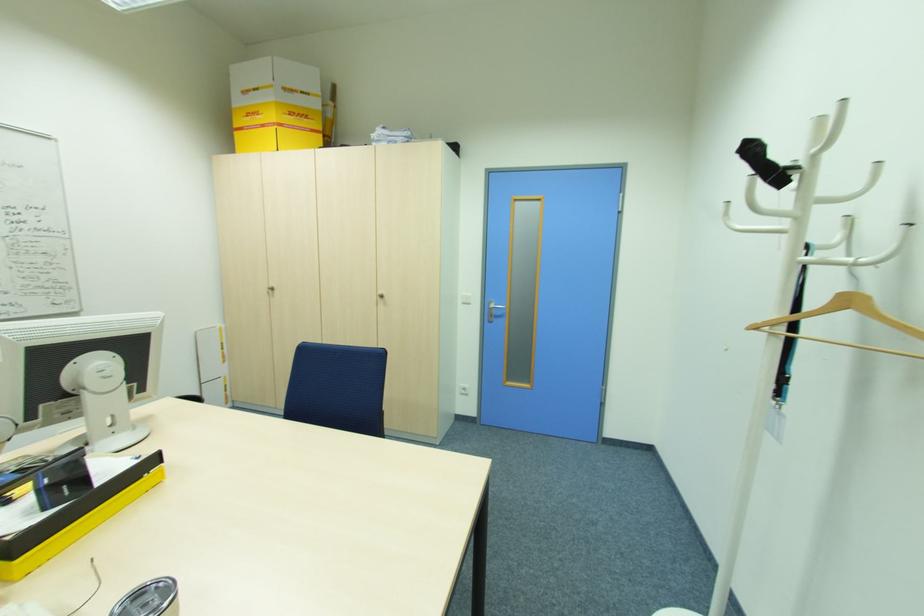
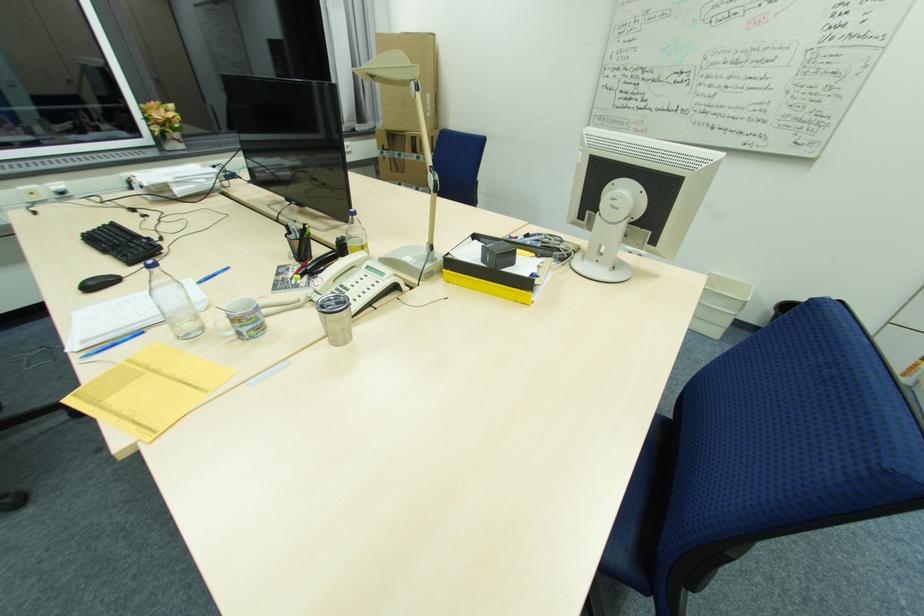
Locate, in the second image, the point that corresponds to point (46, 511) in the first image.

(484, 262)